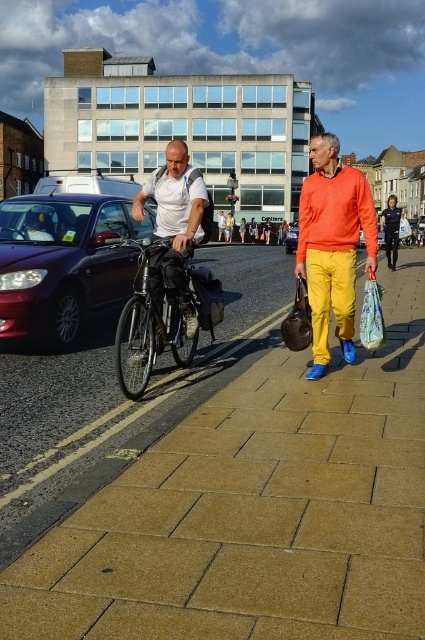
Between matte orange sweater at center and white matte shirt at center, which one is positioned higher?

Positioned higher is matte orange sweater at center.

What do you see at coordinates (333, 244) in the screenshot?
I see `matte orange sweater at center` at bounding box center [333, 244].

Is point (325, 148) closer to camera compared to point (173, 264)?

Yes.

The height and width of the screenshot is (640, 425). Identify the location of matte orange sweater at center. (333, 244).

Is brown stone pavement at center bigger than shiny black car at left?

Actually, brown stone pavement at center might be smaller than shiny black car at left.

Does brown stone pavement at center have a smaller size compared to shiny black car at left?

Indeed, brown stone pavement at center has a smaller size compared to shiny black car at left.

Find the location of a particular element. brown stone pavement at center is located at coordinates (255, 509).

From the picture: Is brown stone pavement at center positioned at the back of matte black backpack at center?

No, it is in front of matte black backpack at center.

Who is more distant from viewer, (175, 593) or (251, 236)?

Point (251, 236)

Does point (234, 602) come closer to viewer compared to point (277, 234)?

Yes, point (234, 602) is closer to viewer.

This screenshot has width=425, height=640. Identify the location of brown stone pavement at center. (255, 509).